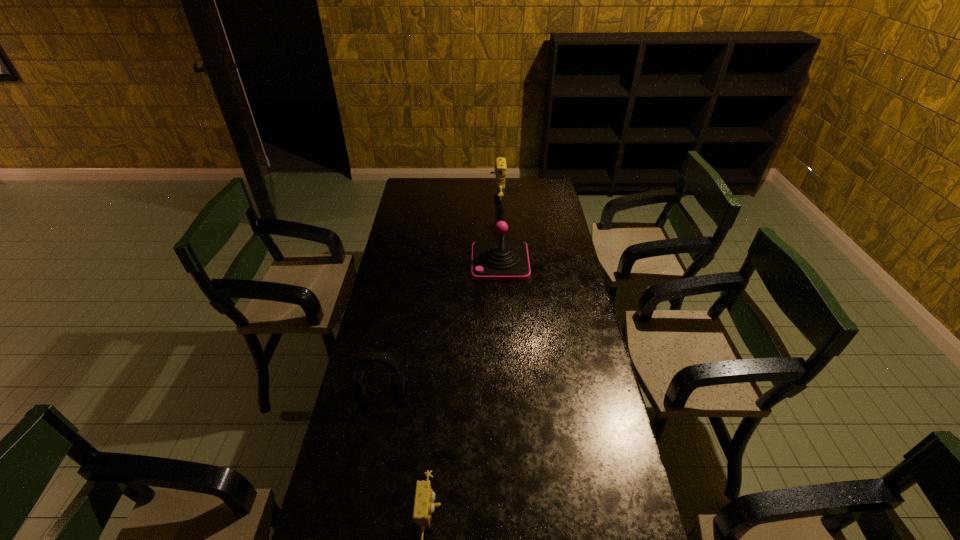
Where is `object that is the second closest to the shortest object`? The width and height of the screenshot is (960, 540). object that is the second closest to the shortest object is located at coordinates (500, 260).

Select which object is the closest to the third nearest object. Please provide its 2D coordinates. Your answer should be formatted as a tuple, i.e. [(x, y)], where the tuple contains the x and y coordinates of a point satisfying the conditions above.

[(500, 168)]

I want to click on vacant space that satisfies the following two spatial constraints: 1. forward from the base of the joystick; 2. on the headband of the third tallest object, so click(x=507, y=390).